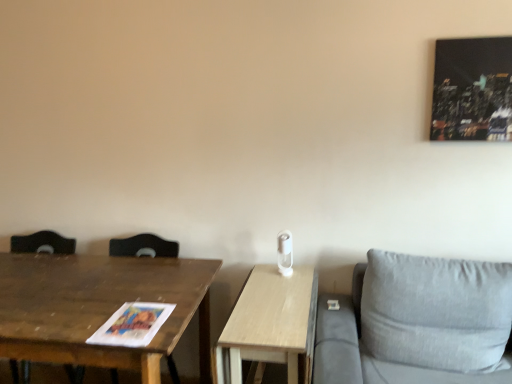
Question: Does wooden table at center, marked as the first table in a right-to-left arrangement, have a greater height compared to wooden table at left, marked as the first table in a left-to-right arrangement?

Choices:
 (A) yes
 (B) no

Answer: (B)

Question: Can you confirm if wooden table at center, the second table when ordered from left to right, is wider than wooden table at left, placed as the 2th table when sorted from right to left?

Choices:
 (A) no
 (B) yes

Answer: (A)

Question: From a real-world perspective, is wooden table at center, the second table when ordered from left to right, on wooden table at left, marked as the first table in a left-to-right arrangement?

Choices:
 (A) no
 (B) yes

Answer: (A)

Question: Considering the relative sizes of wooden table at center, the second table when ordered from left to right, and wooden table at left, placed as the 2th table when sorted from right to left, in the image provided, is wooden table at center, the second table when ordered from left to right, shorter than wooden table at left, placed as the 2th table when sorted from right to left,?

Choices:
 (A) yes
 (B) no

Answer: (A)

Question: Is wooden table at center, the second table when ordered from left to right, at the left side of wooden table at left, marked as the first table in a left-to-right arrangement?

Choices:
 (A) no
 (B) yes

Answer: (A)

Question: Is wooden table at center, the second table when ordered from left to right, bigger or smaller than wooden table at left, marked as the first table in a left-to-right arrangement?

Choices:
 (A) small
 (B) big

Answer: (A)

Question: Is wooden table at center, marked as the first table in a right-to-left arrangement, wider or thinner than wooden table at left, marked as the first table in a left-to-right arrangement?

Choices:
 (A) thin
 (B) wide

Answer: (A)

Question: Is wooden table at center, the second table when ordered from left to right, taller or shorter than wooden table at left, placed as the 2th table when sorted from right to left?

Choices:
 (A) tall
 (B) short

Answer: (B)

Question: Would you say wooden table at center, the second table when ordered from left to right, is inside or outside wooden table at left, marked as the first table in a left-to-right arrangement?

Choices:
 (A) outside
 (B) inside

Answer: (A)

Question: Is wooden table at left, placed as the 2th table when sorted from right to left, in front of or behind wooden table at center, marked as the first table in a right-to-left arrangement, in the image?

Choices:
 (A) behind
 (B) front

Answer: (B)

Question: From the image's perspective, is wooden table at left, marked as the first table in a left-to-right arrangement, located above or below wooden table at center, the second table when ordered from left to right?

Choices:
 (A) below
 (B) above

Answer: (B)

Question: From a real-world perspective, is wooden table at left, marked as the first table in a left-to-right arrangement, physically located above or below wooden table at center, the second table when ordered from left to right?

Choices:
 (A) above
 (B) below

Answer: (A)

Question: Is wooden table at left, marked as the first table in a left-to-right arrangement, bigger or smaller than wooden table at center, marked as the first table in a right-to-left arrangement?

Choices:
 (A) small
 (B) big

Answer: (B)

Question: From the image's perspective, is wooden table at left, marked as the first table in a left-to-right arrangement, above or below brown wooden swivel chair at left?

Choices:
 (A) above
 (B) below

Answer: (B)

Question: From a real-world perspective, relative to brown wooden swivel chair at left, is wooden table at left, placed as the 2th table when sorted from right to left, vertically above or below?

Choices:
 (A) above
 (B) below

Answer: (B)